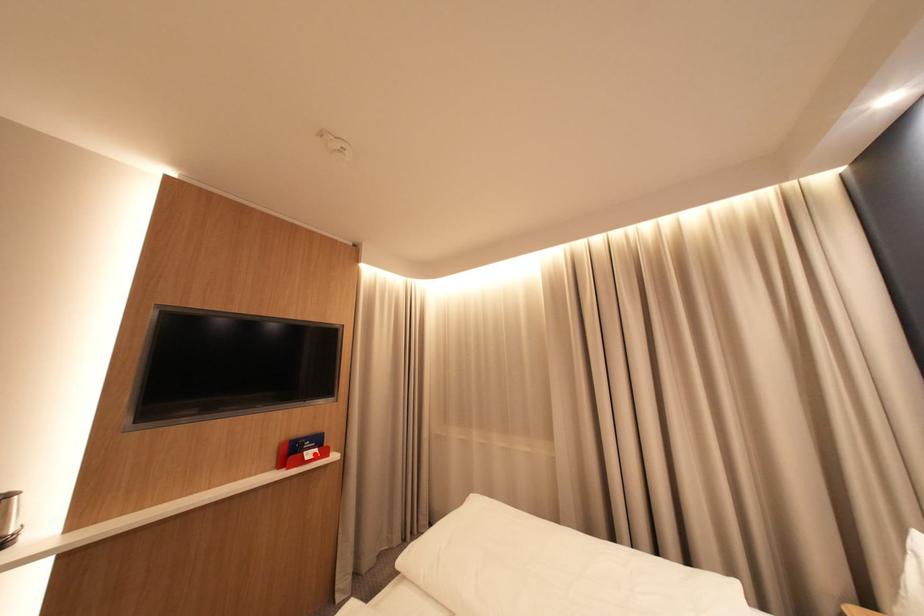
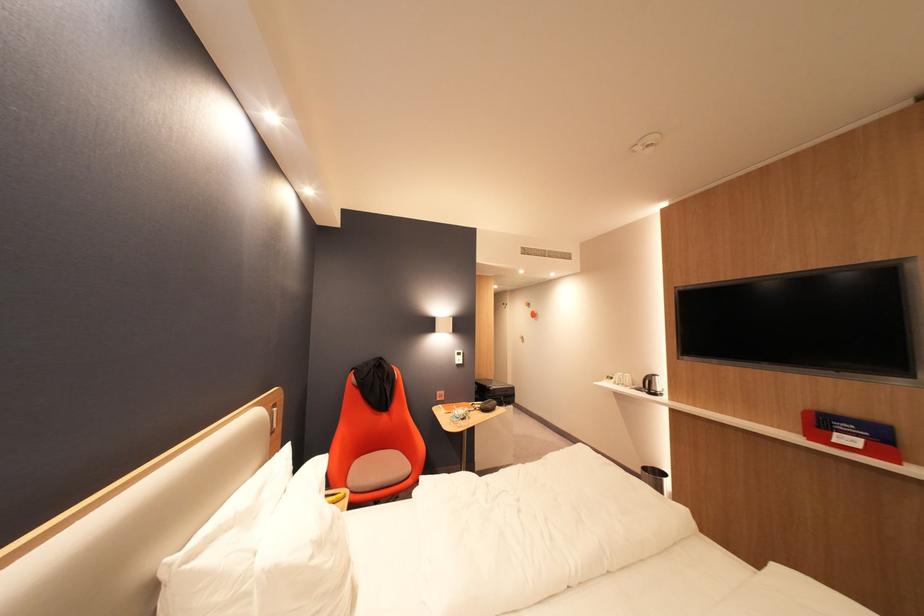
Question: I am providing you with two images of the same scene from different viewpoints. Image1 has a red point marked. In image2, the corresponding 3D location appears at what relative position? Reply with the corresponding letter.

Choices:
 (A) Closer
 (B) Farther

Answer: (A)